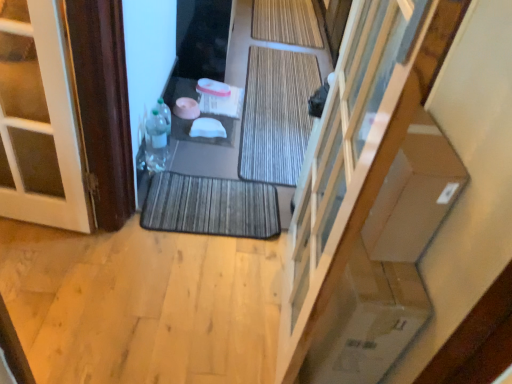
Question: Is point (348, 177) positioned closer to the camera than point (251, 102)?

Choices:
 (A) closer
 (B) farther

Answer: (A)

Question: Is transparent glass door at center wider or thinner than brown textured bath mat at center, marked as the second bath mat in a top-to-bottom arrangement?

Choices:
 (A) wide
 (B) thin

Answer: (B)

Question: Based on their relative distances, which object is nearer to the transparent glass door at center?

Choices:
 (A) brown textured bath mat at center, the 2th bath mat viewed from the back
 (B) translucent plastic bottle at lower left, marked as the first bottle in a top-to-bottom arrangement
 (C) dark gray textured bath mat at center, which ranks as the first bath mat in front-to-back order
 (D) brown wood door at left
 (E) natural bamboo bath mat at center, the first bath mat in the top-to-bottom sequence

Answer: (C)

Question: Which of these objects is positioned closest to the brown textured bath mat at center, the 2th bath mat viewed from the back?

Choices:
 (A) translucent plastic bottle at lower left, marked as the first bottle in a top-to-bottom arrangement
 (B) dark gray textured bath mat at center, which ranks as the first bath mat in front-to-back order
 (C) brown wood door at left
 (D) natural bamboo bath mat at center, which is the 1th bath mat from back to front
 (E) transparent glass door at center

Answer: (B)